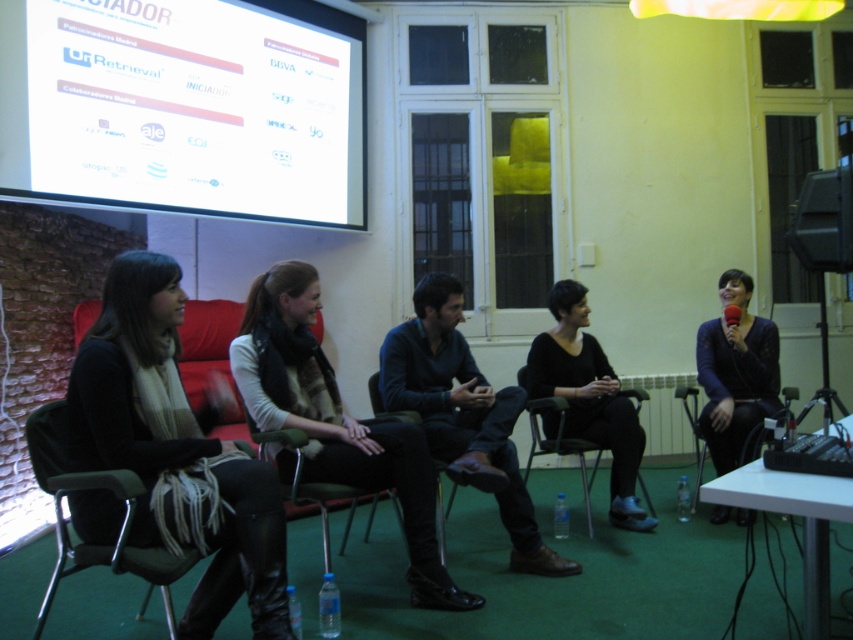
Is black leather jacket at left to the right of knitted scarf at center from the viewer's perspective?

In fact, black leather jacket at left is to the left of knitted scarf at center.

Does black leather jacket at left appear over knitted scarf at center?

Indeed, black leather jacket at left is positioned over knitted scarf at center.

Describe the element at coordinates (177, 449) in the screenshot. This screenshot has width=853, height=640. I see `black leather jacket at left` at that location.

Where is `black leather jacket at left`? Image resolution: width=853 pixels, height=640 pixels. black leather jacket at left is located at coordinates (177, 449).

Is white glossy projection screen at upper left smaller than green plastic chair at lower left?

No, white glossy projection screen at upper left is not smaller than green plastic chair at lower left.

Between white glossy projection screen at upper left and green plastic chair at lower left, which one appears on the left side from the viewer's perspective?

Positioned to the left is white glossy projection screen at upper left.

The height and width of the screenshot is (640, 853). Find the location of `white glossy projection screen at upper left`. white glossy projection screen at upper left is located at coordinates (184, 106).

Is white glossy projection screen at upper left bigger than knitted scarf at center?

Indeed, white glossy projection screen at upper left has a larger size compared to knitted scarf at center.

Does point (358, 164) come closer to viewer compared to point (344, 470)?

No.

Where is `white glossy projection screen at upper left`? white glossy projection screen at upper left is located at coordinates (184, 106).

The width and height of the screenshot is (853, 640). I want to click on white glossy projection screen at upper left, so (184, 106).